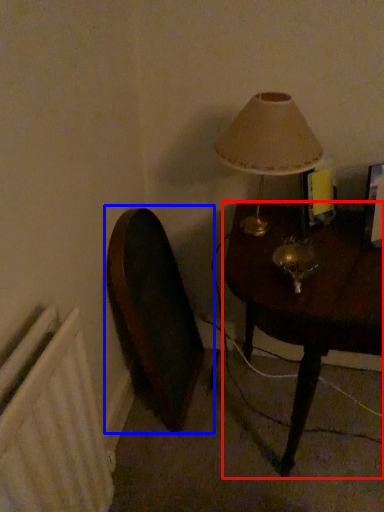
Question: Which object is further to the camera taking this photo, table (highlighted by a red box) or swivel chair (highlighted by a blue box)?

Choices:
 (A) table
 (B) swivel chair

Answer: (B)